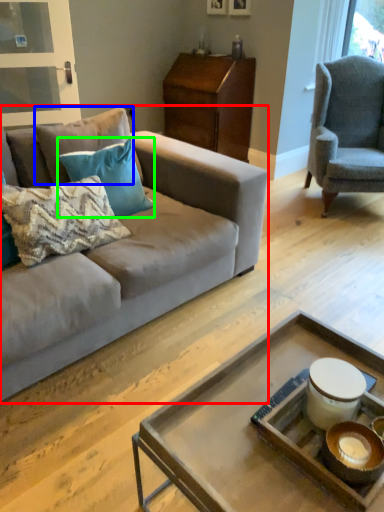
Question: Which is farther away from studio couch (highlighted by a red box)? pillow (highlighted by a blue box) or pillow (highlighted by a green box)?

Choices:
 (A) pillow
 (B) pillow

Answer: (A)